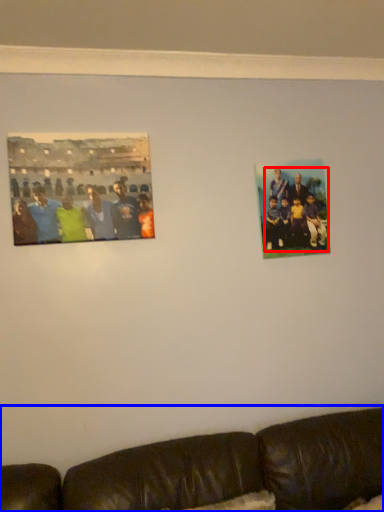
Question: Which object appears farthest to the camera in this image, person (highlighted by a red box) or studio couch (highlighted by a blue box)?

Choices:
 (A) person
 (B) studio couch

Answer: (A)